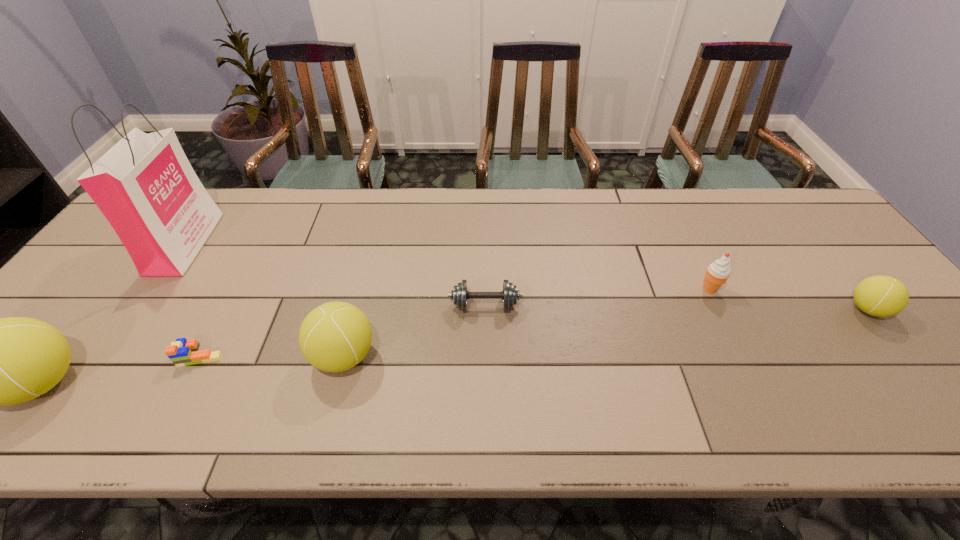
The image size is (960, 540). I want to click on vacant region that satisfies the following two spatial constraints: 1. on the front-facing side of the fourth object from left to right; 2. on the right side of the tallest object, so [107, 356].

Identify the location of blank space that satisfies the following two spatial constraints: 1. on the back side of the rightmost object; 2. on the left side of the fourth object from right to left. The width and height of the screenshot is (960, 540). (355, 309).